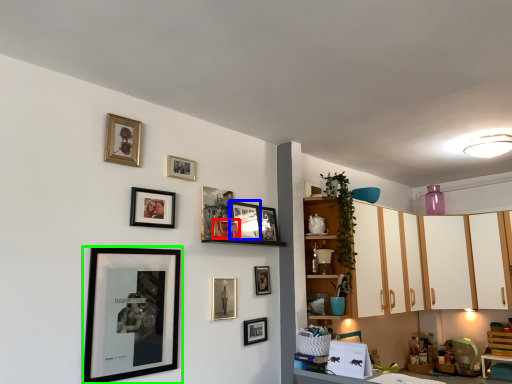
Question: Which object is the farthest from picture frame (highlighted by a red box)? Choose among these: picture frame (highlighted by a blue box) or picture frame (highlighted by a green box).

Choices:
 (A) picture frame
 (B) picture frame

Answer: (B)